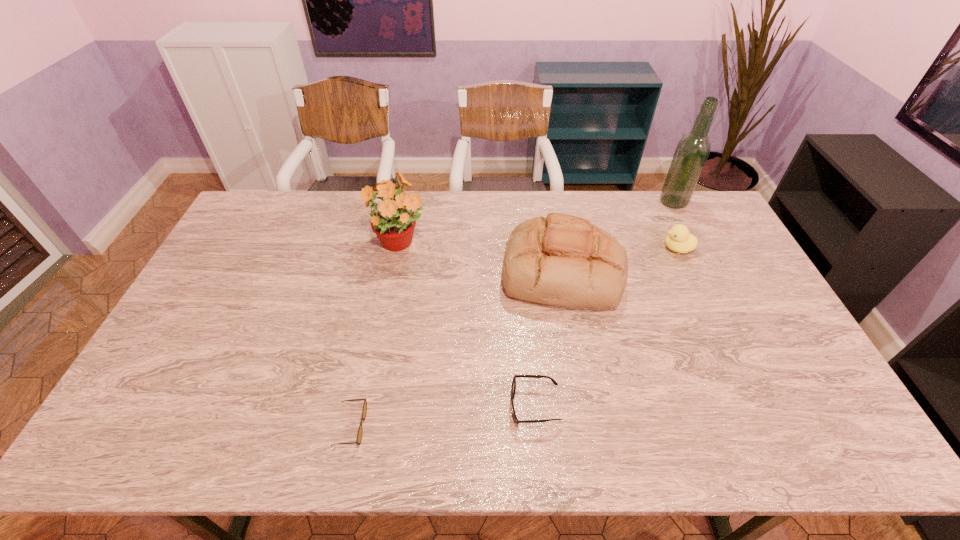
Locate an element on the screen. unoccupied area between the right sunglasses and the flowerpot is located at coordinates (467, 325).

Locate an element on the screen. vacant area that lies between the third tallest object and the left sunglasses is located at coordinates (456, 349).

The image size is (960, 540). What are the coordinates of `unoccupied position between the left sunglasses and the third tallest object` in the screenshot? It's located at (456, 349).

Select which object is the second closest to the fourth shortest object. Please provide its 2D coordinates. Your answer should be formatted as a tuple, i.e. [(x, y)], where the tuple contains the x and y coordinates of a point satisfying the conditions above.

[(513, 388)]

Choose which object is the third nearest neighbor to the flowerpot. Please provide its 2D coordinates. Your answer should be formatted as a tuple, i.e. [(x, y)], where the tuple contains the x and y coordinates of a point satisfying the conditions above.

[(513, 388)]

Where is `vacant area in the image that satisfies the following two spatial constraints: 1. on the front side of the flowerpot; 2. on the front-facing side of the left sunglasses`? The image size is (960, 540). vacant area in the image that satisfies the following two spatial constraints: 1. on the front side of the flowerpot; 2. on the front-facing side of the left sunglasses is located at coordinates (365, 427).

Identify the location of free spot that satisfies the following two spatial constraints: 1. on the front side of the farthest object; 2. at the beak of the duckling. (697, 248).

Where is `free space that satisfies the following two spatial constraints: 1. on the back side of the tallest object; 2. on the left side of the bread`? free space that satisfies the following two spatial constraints: 1. on the back side of the tallest object; 2. on the left side of the bread is located at coordinates (549, 202).